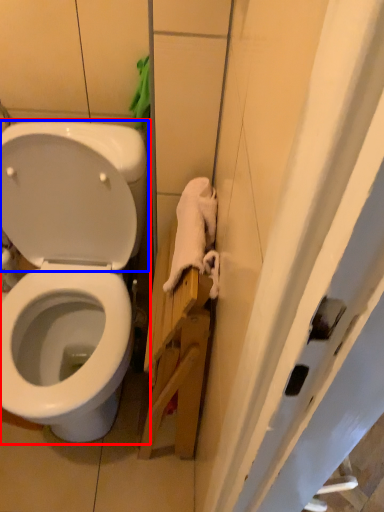
Question: Which object is further to the camera taking this photo, toilet (highlighted by a red box) or back (highlighted by a blue box)?

Choices:
 (A) toilet
 (B) back

Answer: (B)